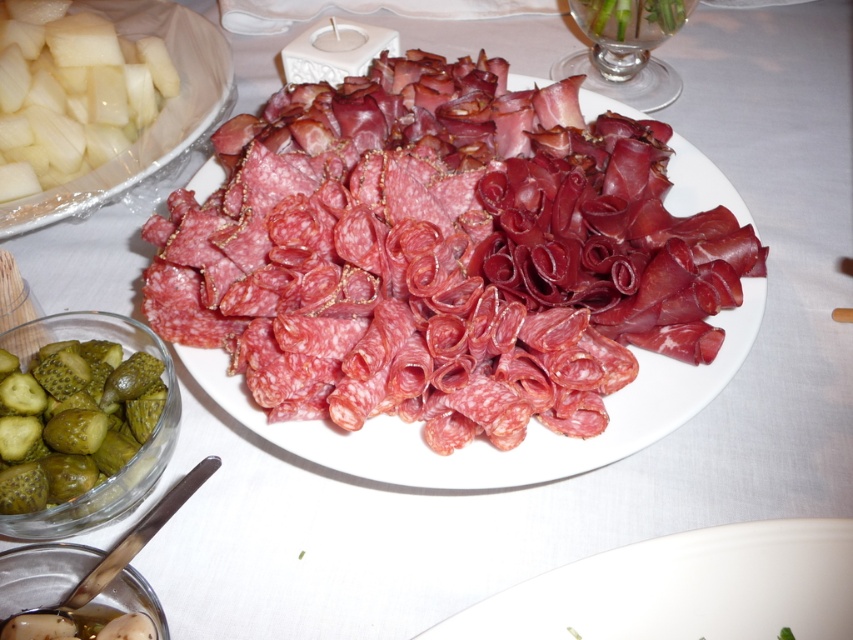
Question: Considering the relative positions of white porcelain plate at lower center and sliced salami at center in the image provided, where is white porcelain plate at lower center located with respect to sliced salami at center?

Choices:
 (A) right
 (B) left

Answer: (A)

Question: Which point is closer to the camera?

Choices:
 (A) (86, 362)
 (B) (675, 19)
 (C) (138, 148)
 (D) (733, 579)

Answer: (D)

Question: Which of the following is the closest to the observer?

Choices:
 (A) (3, 356)
 (B) (344, 337)
 (C) (660, 573)

Answer: (C)

Question: Which object is positioned farthest from the white porcelain plate at lower center?

Choices:
 (A) pinkish-red cured meat at center
 (B) sliced salami at center
 (C) green pickled cucumber at lower left

Answer: (B)

Question: Does white porcelain plate at lower center come behind sliced salami at center?

Choices:
 (A) no
 (B) yes

Answer: (A)

Question: Does white porcelain plate at lower center have a lesser width compared to sliced salami at center?

Choices:
 (A) yes
 (B) no

Answer: (B)